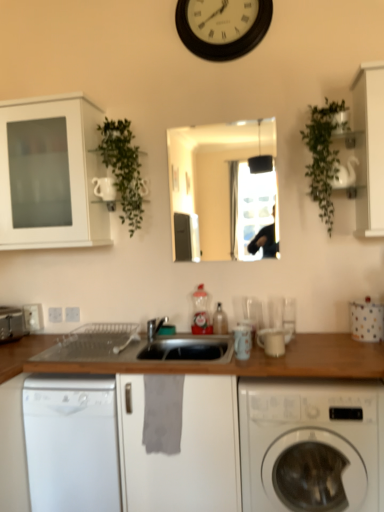
Describe the element at coordinates (366, 320) in the screenshot. This screenshot has height=512, width=384. I see `white polka dot fabric at right, which is the 2th appliance from back to front` at that location.

Identify the location of white matte clock at upper center. coord(222,26).

Measure the distance between point [13,320] and camera.

The distance of point [13,320] from camera is 7.89 feet.

Find the location of `gray fabric at lower center`. gray fabric at lower center is located at coordinates (163, 413).

Describe the element at coordinates (220, 321) in the screenshot. I see `translucent plastic bottle at center, which is the first bottle from right to left` at that location.

I want to click on white polka dot fabric at right, the 4th appliance when ordered from left to right, so click(x=366, y=320).

Based on the photo, from a real-world perspective, is white plastic electric outlet at lower left, acting as the 2th electric outlet starting from the left, physically below white glossy washing machine at lower right?

No, from a real-world perspective, white plastic electric outlet at lower left, acting as the 2th electric outlet starting from the left, is not below white glossy washing machine at lower right.

The image size is (384, 512). Identify the location of washing machine in front of the white plastic electric outlet at lower left, acting as the 2th electric outlet starting from the left. (311, 445).

Considering the relative sizes of white plastic electric outlet at lower left, which appears as the second electric outlet when viewed from the right, and white glossy washing machine at lower right in the image provided, is white plastic electric outlet at lower left, which appears as the second electric outlet when viewed from the right, shorter than white glossy washing machine at lower right?

Indeed, white plastic electric outlet at lower left, which appears as the second electric outlet when viewed from the right, has a lesser height compared to white glossy washing machine at lower right.

Does white plastic electric outlet at lower left, which appears as the second electric outlet when viewed from the right, come in front of white glossy washing machine at lower right?

No, it is not.

From the picture: Does translucent plastic bottle at center, marked as the second bottle in a right-to-left arrangement, touch white glossy dishwasher at lower left?

translucent plastic bottle at center, marked as the second bottle in a right-to-left arrangement, and white glossy dishwasher at lower left are clearly separated.

In the image, there is a translucent plastic bottle at center, which is the first bottle from left to right. Identify the location of dishwasher below it (from a real-world perspective). (71, 443).

Which point is more distant from viewer, (197, 326) or (110, 500)?

The point (197, 326) is farther from the camera.

Which of these two, translucent plastic bottle at center, which is the first bottle from left to right, or white glossy dishwasher at lower left, is bigger?

white glossy dishwasher at lower left is bigger.

Between white glossy cabinet at upper right, the 2th cabinetry in the left-to-right sequence, and metallic silver toaster at left, the fourth appliance positioned from the right, which one has smaller size?

With smaller size is metallic silver toaster at left, the fourth appliance positioned from the right.

Is white glossy cabinet at upper right, the first cabinetry in the front-to-back sequence, aimed at metallic silver toaster at left, the 1th appliance viewed from the left?

No, white glossy cabinet at upper right, the first cabinetry in the front-to-back sequence, is not turned towards metallic silver toaster at left, the 1th appliance viewed from the left.

In the scene shown: Does white glossy cabinet at upper right, positioned as the second cabinetry in back-to-front order, have a lesser height compared to metallic silver toaster at left, the fourth appliance from the front?

Incorrect, the height of white glossy cabinet at upper right, positioned as the second cabinetry in back-to-front order, does not fall short of that of metallic silver toaster at left, the fourth appliance from the front.

From the image's perspective, who appears lower, white glossy cabinet at upper right, positioned as the second cabinetry in back-to-front order, or metallic silver toaster at left, the 1th appliance viewed from the left?

metallic silver toaster at left, the 1th appliance viewed from the left, appears lower in the image.

Which point is more forward, (320, 148) or (383, 84)?

The point (383, 84) is in front.

Does green leafy plant at upper right, which is counted as the 1th plant, starting from the right, have a greater width compared to white glossy cabinet at upper right, the first cabinetry in the front-to-back sequence?

No.

From the image's perspective, is green leafy plant at upper right, acting as the second plant starting from the left, on white glossy cabinet at upper right, positioned as the second cabinetry in back-to-front order?

No, from the image's perspective, green leafy plant at upper right, acting as the second plant starting from the left, is not above white glossy cabinet at upper right, positioned as the second cabinetry in back-to-front order.

From a real-world perspective, is green leafy plant at upper right, which is counted as the 1th plant, starting from the right, physically located above or below white glossy cabinet at upper right, the first cabinetry in the front-to-back sequence?

green leafy plant at upper right, which is counted as the 1th plant, starting from the right, is situated lower than white glossy cabinet at upper right, the first cabinetry in the front-to-back sequence, in the real world.

Based on their sizes in the image, would you say white plastic electric outlet at lower left, which appears as the second electric outlet when viewed from the right, is bigger or smaller than white ceramic mug at center, the third appliance when ordered from left to right?

Considering their sizes, white plastic electric outlet at lower left, which appears as the second electric outlet when viewed from the right, takes up less space than white ceramic mug at center, the third appliance when ordered from left to right.

In the scene shown: Which is farther from the camera, (x=52, y=312) or (x=275, y=329)?

The point (x=52, y=312) is more distant.

Considering the relative sizes of white plastic electric outlet at lower left, which appears as the second electric outlet when viewed from the right, and white ceramic mug at center, the second appliance positioned from the right, in the image provided, is white plastic electric outlet at lower left, which appears as the second electric outlet when viewed from the right, shorter than white ceramic mug at center, the second appliance positioned from the right,?

Correct, white plastic electric outlet at lower left, which appears as the second electric outlet when viewed from the right, is not as tall as white ceramic mug at center, the second appliance positioned from the right.

The image size is (384, 512). I want to click on the 3rd appliance below the white plastic electric outlet at lower left, which appears as the second electric outlet when viewed from the right (from the image's perspective), so click(x=272, y=341).

From the image's perspective, between white ceramic mug at center, the second appliance positioned from the right, and white glossy washing machine at lower right, which one is located above?

white ceramic mug at center, the second appliance positioned from the right.

Image resolution: width=384 pixels, height=512 pixels. I want to click on the 1st appliance positioned above the white glossy washing machine at lower right (from the image's perspective), so click(272, 341).

Do you think white ceramic mug at center, marked as the second appliance in a front-to-back arrangement, is within white glossy washing machine at lower right, or outside of it?

white ceramic mug at center, marked as the second appliance in a front-to-back arrangement, cannot be found inside white glossy washing machine at lower right.

How many degrees apart are the facing directions of gray fabric at lower center and white matte clock at upper center?

The angle between the facing direction of gray fabric at lower center and the facing direction of white matte clock at upper center is 1.94 degrees.

From the image's perspective, is gray fabric at lower center under white matte clock at upper center?

Yes.

Is gray fabric at lower center not inside white matte clock at upper center?

gray fabric at lower center is positioned outside white matte clock at upper center.

Considering the sizes of objects gray fabric at lower center and white matte clock at upper center in the image provided, who is shorter, gray fabric at lower center or white matte clock at upper center?

gray fabric at lower center is shorter.

I want to click on washing machine that is below the white plastic electric outlet at lower left, acting as the 2th electric outlet starting from the left (from the image's perspective), so point(311,445).

Identify the location of dishwasher located on the left of translucent plastic bottle at center, marked as the second bottle in a right-to-left arrangement. The height and width of the screenshot is (512, 384). (71, 443).

When comparing their distances from white plastic electric outlet at lower left, which is counted as the 3th electric outlet, starting from the right, does white plastic electric outlet at lower left, the third electric outlet positioned from the left, or white ceramic mug at center, the second appliance positioned from the right, seem further?

white ceramic mug at center, the second appliance positioned from the right.

Looking at the image, which one is located closer to white plastic electric outlet at lower left, the third electric outlet positioned from the left, white glossy cabinet at upper right, positioned as the second cabinetry in back-to-front order, or gray fabric at lower center?

gray fabric at lower center lies closer to white plastic electric outlet at lower left, the third electric outlet positioned from the left, than the other object.

Based on their spatial positions, is green leafy plant at upper right, acting as the second plant starting from the left, or white plastic electric outlet at lower left, the 1th electric outlet from the left, further from white plastic electric outlet at lower left, acting as the 2th electric outlet starting from the left?

Among the two, green leafy plant at upper right, acting as the second plant starting from the left, is located further to white plastic electric outlet at lower left, acting as the 2th electric outlet starting from the left.

Based on their spatial positions, is translucent plastic bottle at center, marked as the second bottle in a right-to-left arrangement, or white polka dot fabric at right, which is the first appliance in right-to-left order, closer to green leafy plant at upper right, which is counted as the 1th plant, starting from the right?

Based on the image, white polka dot fabric at right, which is the first appliance in right-to-left order, appears to be nearer to green leafy plant at upper right, which is counted as the 1th plant, starting from the right.

Estimate the real-world distances between objects in this image. Which object is further from white matte clock at upper center, gray fabric at lower center or wooden at lower center?

gray fabric at lower center is further to white matte clock at upper center.

Looking at the image, which one is located closer to white plastic electric outlet at lower left, which appears as the second electric outlet when viewed from the right, metallic silver toaster at left, the fourth appliance from the front, or translucent plastic bottle at center, which is the 2th bottle from left to right?

The object closer to white plastic electric outlet at lower left, which appears as the second electric outlet when viewed from the right, is metallic silver toaster at left, the fourth appliance from the front.

From the image, which object appears to be farther from white matte cabinet at upper left, arranged as the second cabinetry when viewed from the front, translucent plastic bottle at center, which is the first bottle from left to right, or matte ceramic mug at center, the third appliance positioned from the right?

Based on the image, matte ceramic mug at center, the third appliance positioned from the right, appears to be further to white matte cabinet at upper left, arranged as the second cabinetry when viewed from the front.

When comparing their distances from white plastic electric outlet at lower left, acting as the 2th electric outlet starting from the left, does white glossy washing machine at lower right or white glossy cabinet at upper right, which is counted as the 1th cabinetry, starting from the right, seem further?

white glossy cabinet at upper right, which is counted as the 1th cabinetry, starting from the right, is further to white plastic electric outlet at lower left, acting as the 2th electric outlet starting from the left.

The image size is (384, 512). I want to click on plant between white plastic electric outlet at lower left, acting as the 2th electric outlet starting from the left, and green leafy plant at upper right, acting as the second plant starting from the left, from left to right, so click(x=123, y=168).

Identify the location of clothe between green leafy plant at upper right, acting as the second plant starting from the left, and white glossy washing machine at lower right from top to bottom. This screenshot has height=512, width=384. (163, 413).

The width and height of the screenshot is (384, 512). I want to click on washing machine located between white plastic electric outlet at lower left, which is counted as the 3th electric outlet, starting from the right, and white glossy cabinet at upper right, positioned as the second cabinetry in back-to-front order, in the left-right direction, so click(311, 445).

Identify the location of washing machine located between translucent plastic bottle at center, which is the first bottle from left to right, and white polka dot fabric at right, the 4th appliance when ordered from left to right, in the left-right direction. The height and width of the screenshot is (512, 384). (311, 445).